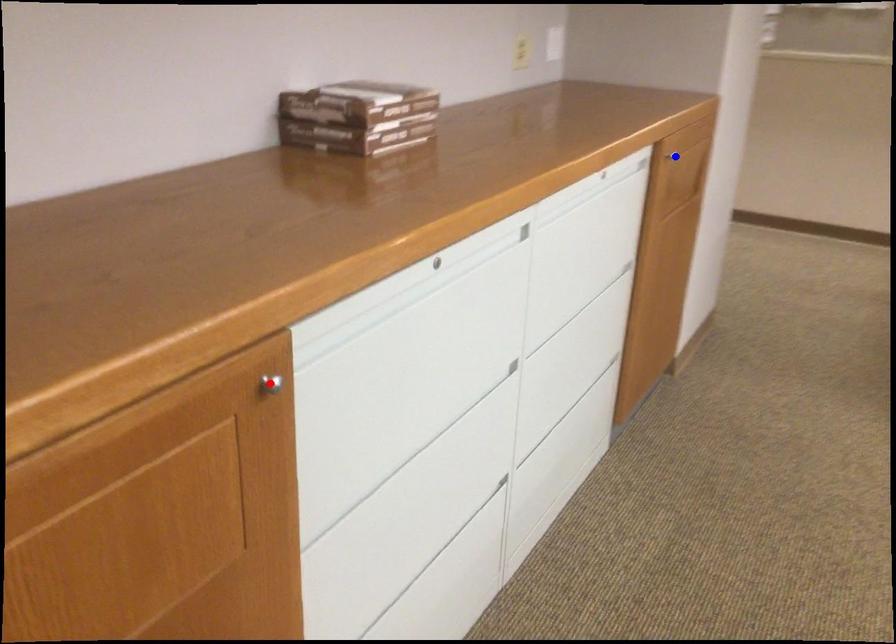
Question: Two points are marked on the image. Which point is closer to the camera?

Choices:
 (A) Blue point is closer.
 (B) Red point is closer.

Answer: (B)